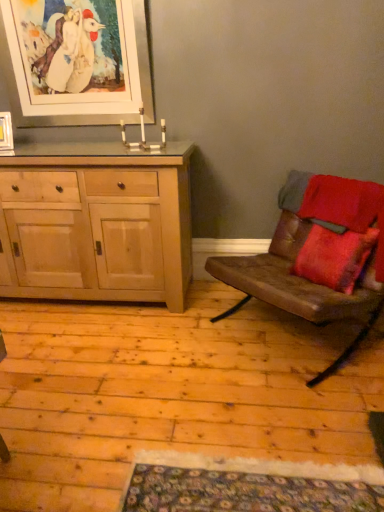
Where is `vacant space in white matte picture frame at upper left, positioned as the second picture frame in bottom-to-top order (from a real-world perspective)`? The image size is (384, 512). vacant space in white matte picture frame at upper left, positioned as the second picture frame in bottom-to-top order (from a real-world perspective) is located at coordinates (86, 144).